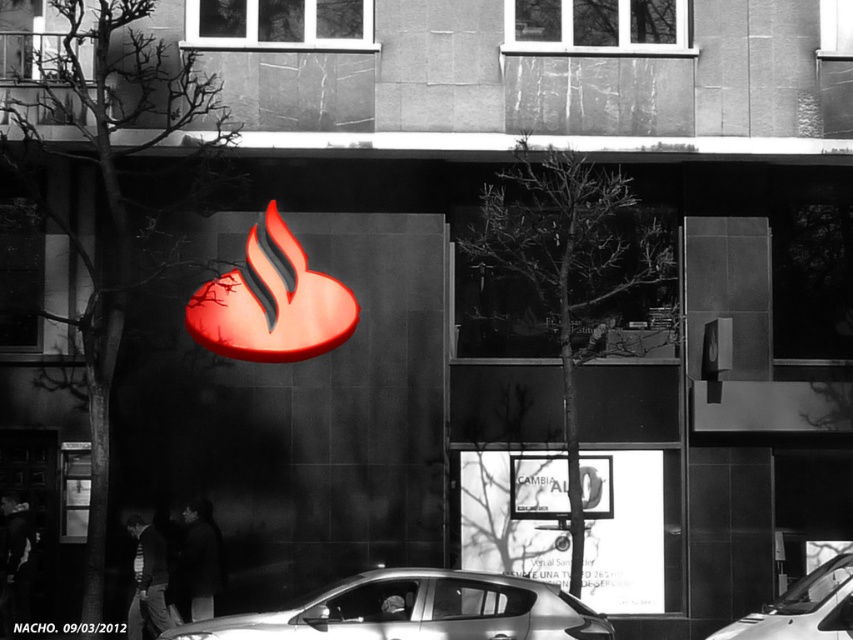
You are standing at the entrance of the building and want to park your car at the exact location where the silver metallic car at lower center is currently parked. What are the coordinates of the parking spot?

The coordinates of the parking spot where the silver metallic car at lower center is parked are at point [416,611].

You are a photographer trying to capture the entire scene in one photo. You notice the silver metallic car at lower center and the glossy plastic heart at center. Which object will require a wider angle lens to capture its full width in the photo?

The silver metallic car at lower center requires a wider angle lens because its width is larger than the glossy plastic heart at center.

You are a pedestrian standing on the sidewalk in front of the building. You see the glossy plastic heart at center and the white glossy car at lower right. Which object is closer to you?

The glossy plastic heart at center is closer to you because the white glossy car at lower right is behind it.